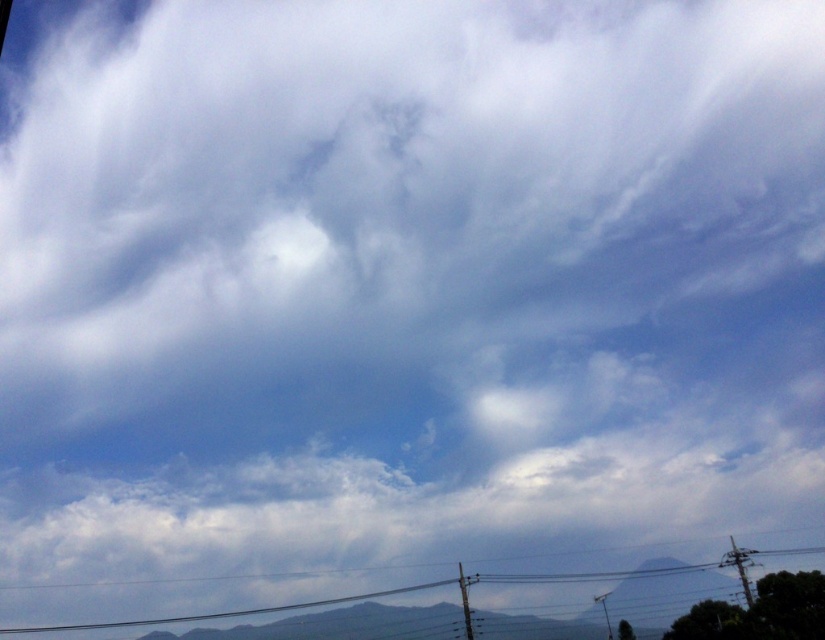
Question: Can you confirm if black wire at bottom is positioned to the left of metallic gray pole at lower center?

Choices:
 (A) yes
 (B) no

Answer: (A)

Question: Can you confirm if black wire at bottom is bigger than metallic gray pole at lower center?

Choices:
 (A) yes
 (B) no

Answer: (A)

Question: Which object is closer to the camera taking this photo?

Choices:
 (A) black wire at bottom
 (B) metallic gray pole at lower center

Answer: (B)

Question: From the image, what is the correct spatial relationship of black wire at bottom in relation to metallic gray pole at lower center?

Choices:
 (A) below
 (B) above

Answer: (A)

Question: Which point is farther from the camera taking this photo?

Choices:
 (A) coord(462,580)
 (B) coord(145,625)

Answer: (B)